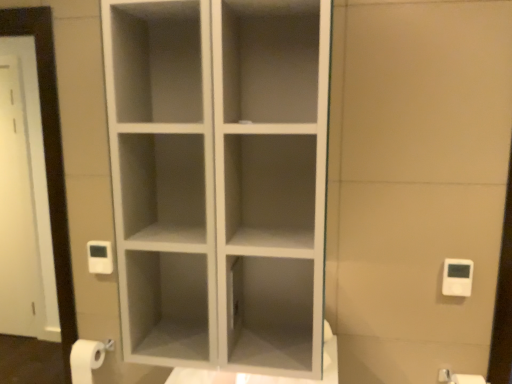
Question: Is white matte toilet paper at lower right not inside white plastic light switch at right?

Choices:
 (A) no
 (B) yes

Answer: (B)

Question: Are white matte toilet paper at lower right and white plastic light switch at right far apart?

Choices:
 (A) yes
 (B) no

Answer: (B)

Question: Is white matte toilet paper at lower right further to the viewer compared to white plastic light switch at right?

Choices:
 (A) yes
 (B) no

Answer: (B)

Question: Is white matte toilet paper at lower right bigger than white plastic light switch at right?

Choices:
 (A) yes
 (B) no

Answer: (A)

Question: From a real-world perspective, is white matte toilet paper at lower right under white plastic light switch at right?

Choices:
 (A) yes
 (B) no

Answer: (A)

Question: Is white matte toilet paper at lower right positioned in front of white plastic light switch at right?

Choices:
 (A) yes
 (B) no

Answer: (A)

Question: Can you confirm if white plastic light switch at right is smaller than white matte toilet paper at lower right?

Choices:
 (A) no
 (B) yes

Answer: (B)

Question: Is white plastic light switch at right with white matte toilet paper at lower right?

Choices:
 (A) yes
 (B) no

Answer: (B)

Question: Does white plastic light switch at right have a lesser height compared to white matte toilet paper at lower right?

Choices:
 (A) yes
 (B) no

Answer: (A)

Question: From a real-world perspective, is white plastic light switch at right positioned over white matte toilet paper at lower right based on gravity?

Choices:
 (A) no
 (B) yes

Answer: (B)

Question: Can you confirm if white plastic light switch at right is wider than white matte toilet paper at lower right?

Choices:
 (A) yes
 (B) no

Answer: (B)

Question: From a real-world perspective, is white plastic light switch at right positioned under white matte toilet paper at lower right based on gravity?

Choices:
 (A) no
 (B) yes

Answer: (A)

Question: In terms of width, does white matte toilet paper at lower right look wider or thinner when compared to white plastic light switch at right?

Choices:
 (A) wide
 (B) thin

Answer: (A)